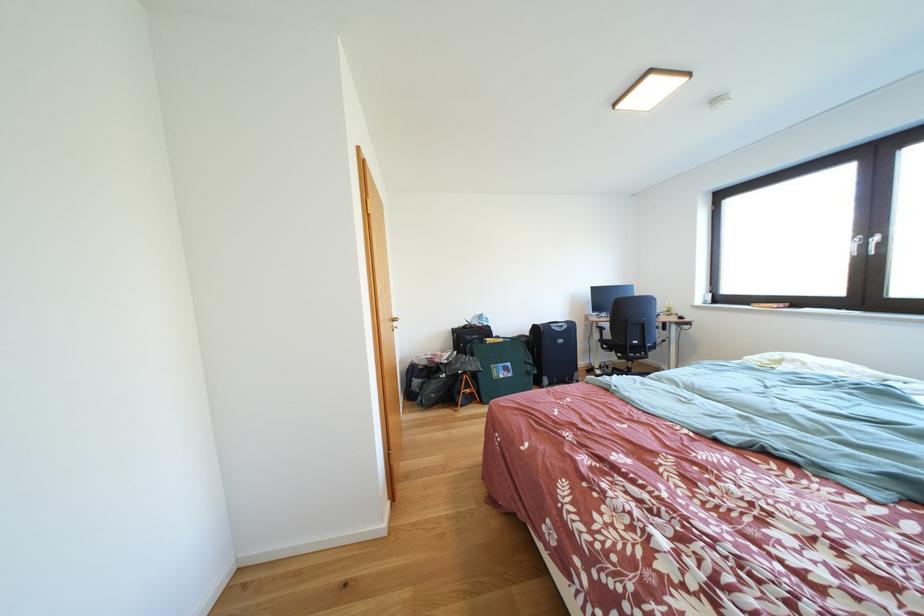
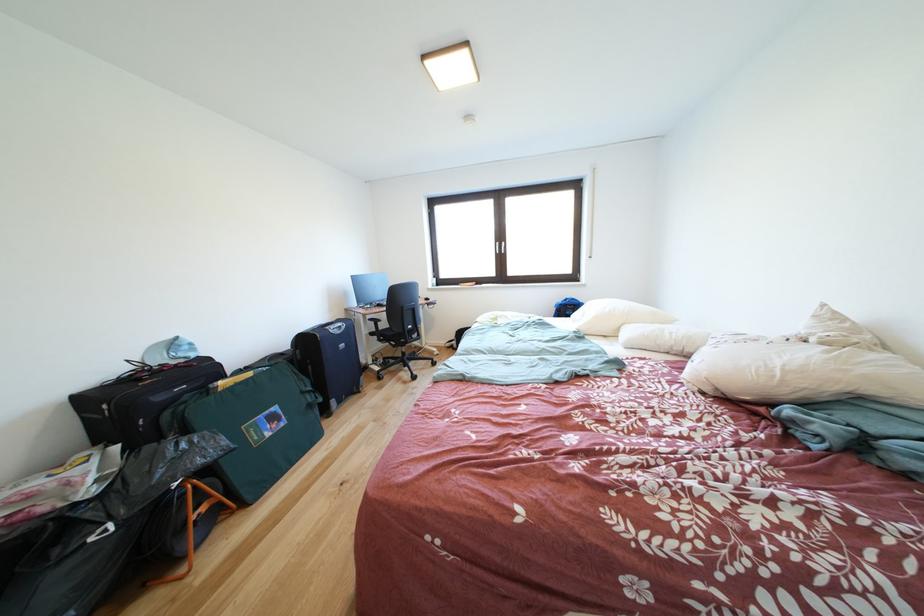
Locate, in the second image, the point that corresponds to [627,363] in the first image.

(403, 351)